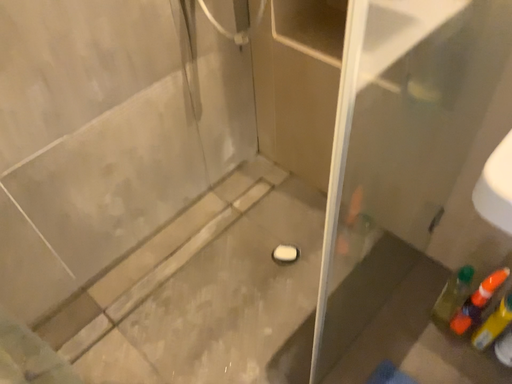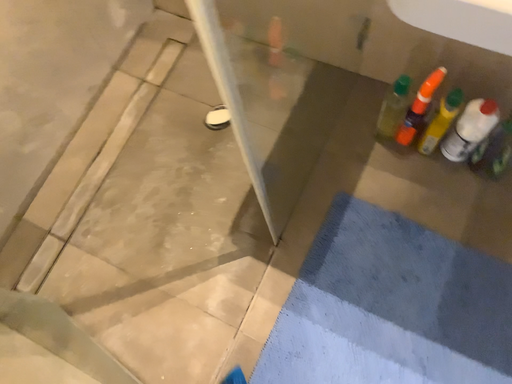
Question: Which way did the camera rotate in the video?

Choices:
 (A) rotated left
 (B) rotated right

Answer: (B)